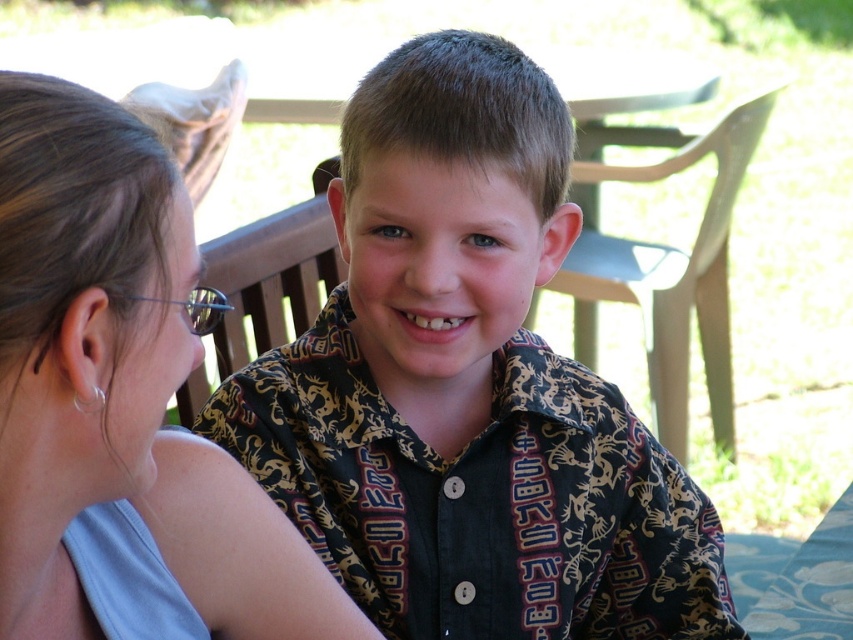
Question: Is printed fabric shirt at center positioned in front of matte gray hair at upper left?

Choices:
 (A) yes
 (B) no

Answer: (B)

Question: Does printed fabric shirt at center have a greater width compared to matte gray hair at upper left?

Choices:
 (A) no
 (B) yes

Answer: (B)

Question: Is printed fabric shirt at center smaller than matte gray hair at upper left?

Choices:
 (A) yes
 (B) no

Answer: (B)

Question: Among these points, which one is farthest from the camera?

Choices:
 (A) (506, 561)
 (B) (135, 346)

Answer: (A)